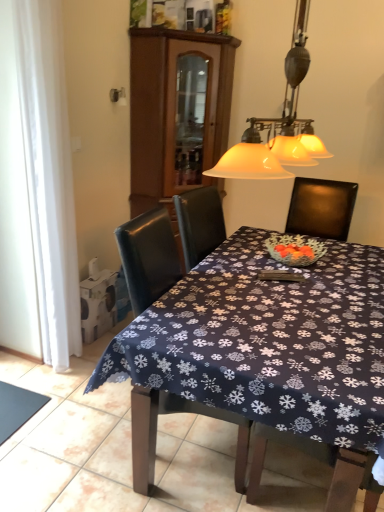
Locate an element on the screen. The height and width of the screenshot is (512, 384). free space that is in between leather chair at center and dark blue fabric at lower left is located at coordinates (80, 420).